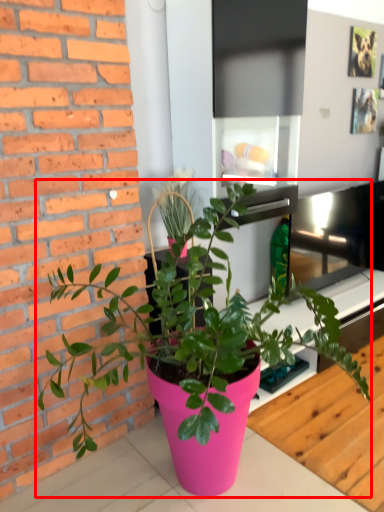
Question: From the image's perspective, considering the relative positions of houseplant (annotated by the red box) and table in the image provided, where is houseplant (annotated by the red box) located with respect to the staircase?

Choices:
 (A) below
 (B) above

Answer: (B)